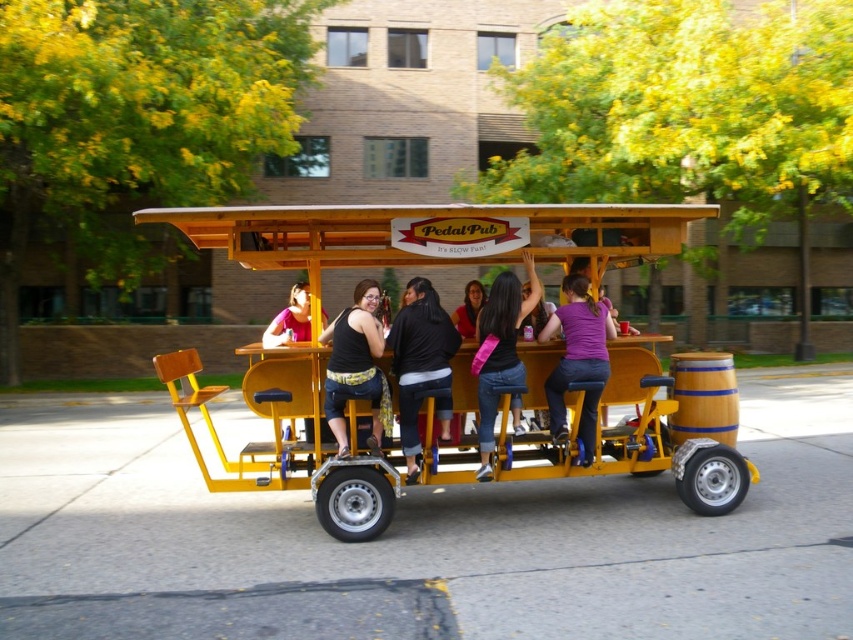
Question: Which object appears closest to the camera in this image?

Choices:
 (A) yellow wood pedal pub at center
 (B) matte black tank top at center
 (C) matte black shirt at center
 (D) purple matte shirt at center

Answer: (A)

Question: Can you confirm if yellow wood pedal pub at center is positioned to the left of purple matte shirt at center?

Choices:
 (A) yes
 (B) no

Answer: (A)

Question: Is matte black tank top at center behind purple matte shirt at center?

Choices:
 (A) yes
 (B) no

Answer: (B)

Question: Which object is farther from the camera taking this photo?

Choices:
 (A) black matte pants at center
 (B) matte black tank top at center
 (C) matte black shirt at center
 (D) purple matte shirt at center

Answer: (D)

Question: Does black matte pants at center appear on the left side of matte black tank top at center?

Choices:
 (A) yes
 (B) no

Answer: (B)

Question: Among these points, which one is nearest to the camera?

Choices:
 (A) pos(442,433)
 (B) pos(492,323)

Answer: (B)